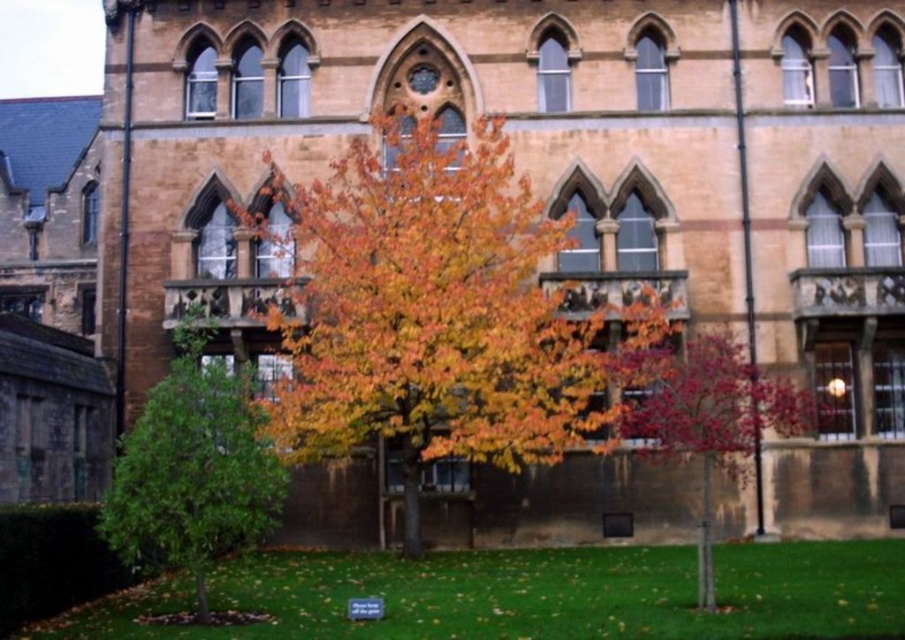
Does multicolored foliage at center have a larger size compared to shiny red leaves at center?

Yes.

Based on the photo, can you confirm if multicolored foliage at center is positioned below shiny red leaves at center?

Incorrect, multicolored foliage at center is not positioned below shiny red leaves at center.

Which is in front, point (284, 202) or point (729, 444)?

Point (729, 444) is more forward.

The width and height of the screenshot is (905, 640). I want to click on multicolored foliage at center, so click(436, 310).

Between point (430, 218) and point (254, 417), which one is positioned behind?

The point (430, 218) is behind.

Does multicolored foliage at center lie in front of green leafy tree at lower left?

No, it is not.

Between point (382, 280) and point (264, 508), which one is positioned in front?

Point (264, 508)

Locate an element on the screen. multicolored foliage at center is located at coordinates (436, 310).

Does green leafy tree at lower left appear on the left side of shiny red leaves at center?

Correct, you'll find green leafy tree at lower left to the left of shiny red leaves at center.

This screenshot has height=640, width=905. In order to click on green leafy tree at lower left in this screenshot , I will do `click(193, 468)`.

This screenshot has height=640, width=905. Describe the element at coordinates (193, 468) in the screenshot. I see `green leafy tree at lower left` at that location.

At what (x,y) coordinates should I click in order to perform the action: click on green leafy tree at lower left. Please return your answer as a coordinate pair (x, y). The width and height of the screenshot is (905, 640). Looking at the image, I should click on (193, 468).